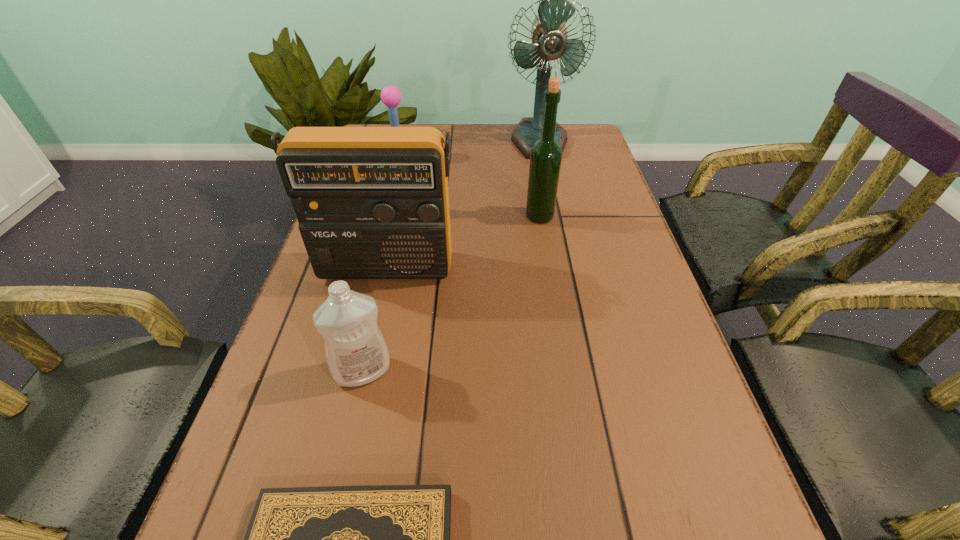
This screenshot has width=960, height=540. In order to click on vacant region that satisfies the following two spatial constraints: 1. in front of the fan where the wind blows; 2. forward from the base of the joystick in this screenshot , I will do `click(543, 159)`.

This screenshot has width=960, height=540. In order to click on free spot that satisfies the following two spatial constraints: 1. forward from the base of the joystick; 2. on the right side of the detergent in this screenshot , I will do `click(344, 371)`.

I want to click on free location that satisfies the following two spatial constraints: 1. forward from the base of the second nearest object; 2. on the left side of the joystick, so click(344, 371).

You are a GUI agent. You are given a task and a screenshot of the screen. Output one action in this format:
    pyautogui.click(x=<x>, y=<y>)
    Task: Click on the free location that satisfies the following two spatial constraints: 1. on the front-facing side of the detergent; 2. on the right side of the fourth farthest object
    The image size is (960, 540).
    Given the screenshot: What is the action you would take?
    pyautogui.click(x=363, y=371)

The height and width of the screenshot is (540, 960). Find the location of `vacant point that satisfies the following two spatial constraints: 1. forward from the base of the third farthest object; 2. on the right side of the joystick`. vacant point that satisfies the following two spatial constraints: 1. forward from the base of the third farthest object; 2. on the right side of the joystick is located at coordinates (384, 217).